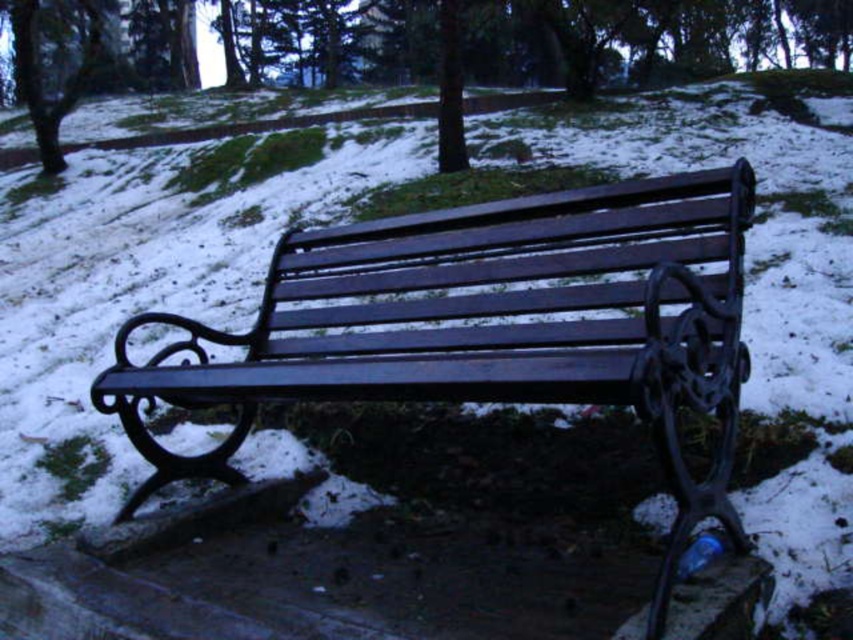
You are planning to take a photo of the green matte tree at center and the smooth bark tree at upper left. Which tree should you focus on first if you want to capture both in the frame without moving the camera?

The green matte tree at center is shorter than the smooth bark tree at upper left, so you should focus on the smooth bark tree at upper left first to ensure it fits in the frame.

You are an observer standing in front of the wooden bench. You notice two trees in the scene. Which tree is taller, the green matte tree at center or the smooth bark tree at upper left?

The smooth bark tree at upper left is taller than the green matte tree at center.

You are standing at the point marked as point (523, 42) in the scene. What object is located exactly at that point?

The green matte tree at center is located exactly at point (523, 42).